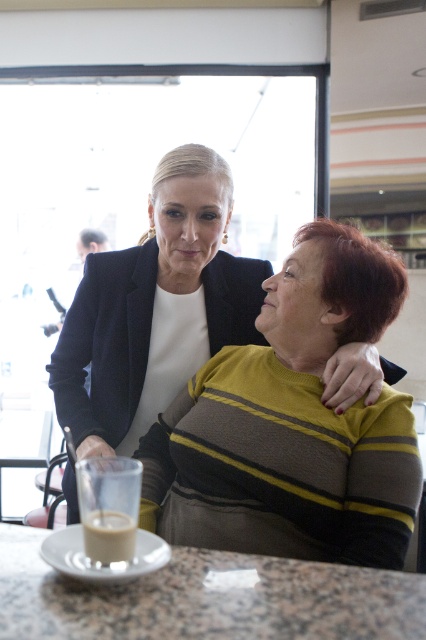
You are a barista trying to clean the counter. You need to move the white frothy coffee at lower left first. Can you lift the matte black blazer at upper left to access it?

The matte black blazer at upper left is positioned over white frothy coffee at lower left, so you cannot lift the matte black blazer at upper left to access the white frothy coffee at lower left because the blazer is covering it.

You are a photographer setting up a shoot in this scene. You need to position a spotlight so it can illuminate both the matte black blazer at upper left and the granite table at lower center without casting shadows over other areas. Given their heights, which object should the spotlight be angled towards first?

The spotlight should be angled towards the matte black blazer at upper left first because it is taller than the granite table at lower center, ensuring both are illuminated without casting shadows on other areas.

You are a customer in the cafe and want to know where the matte black blazer at upper left is located in the image. Please provide its coordinates as a point in the format of x,y where x is the horizontal axis and y is the vertical axis.

The matte black blazer at upper left is located at point [155,308].